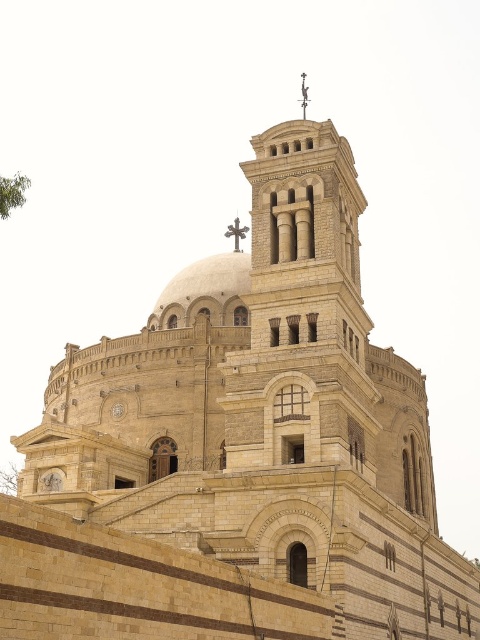
Is the position of beige stone dome at center more distant than that of metallic cross at upper center?

No, it is not.

Is beige stone dome at center bigger than metallic cross at upper center?

Indeed, beige stone dome at center has a larger size compared to metallic cross at upper center.

Identify the location of beige stone dome at center. (205, 282).